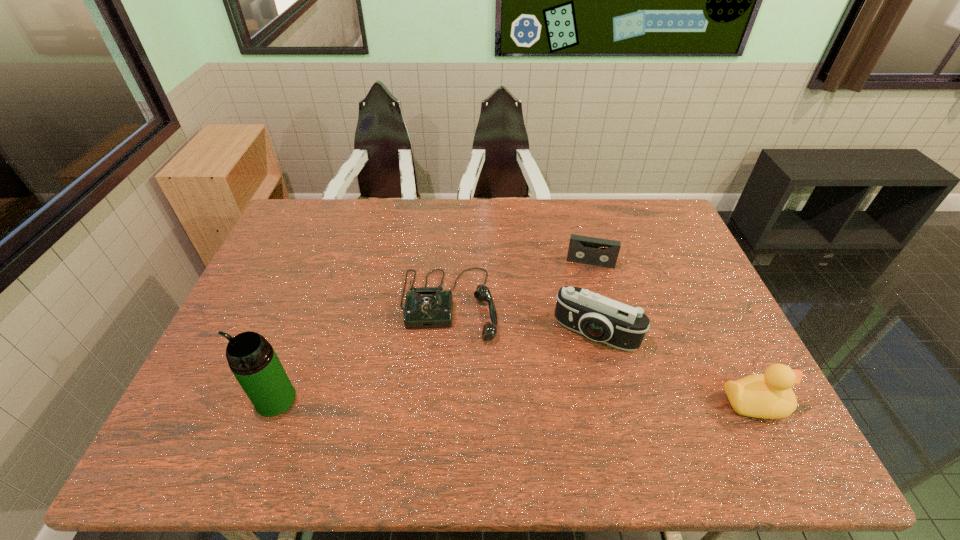
Identify which object is the third nearest to the camera. Please provide its 2D coordinates. Your answer should be formatted as a tuple, i.e. [(x, y)], where the tuple contains the x and y coordinates of a point satisfying the conditions above.

[(582, 249)]

The width and height of the screenshot is (960, 540). Find the location of `free region that satisfies the following two spatial constraints: 1. on the front side of the duck; 2. on the face of the shortest object`. free region that satisfies the following two spatial constraints: 1. on the front side of the duck; 2. on the face of the shortest object is located at coordinates (628, 403).

Find the location of a particular element. vacant space that satisfies the following two spatial constraints: 1. on the front side of the fourth tallest object; 2. on the face of the rightmost object is located at coordinates (442, 403).